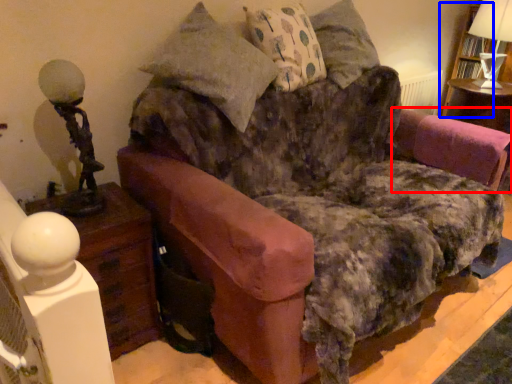
Question: Which object appears closest to the camera in this image, swivel chair (highlighted by a red box) or bookshelf (highlighted by a blue box)?

Choices:
 (A) swivel chair
 (B) bookshelf

Answer: (A)